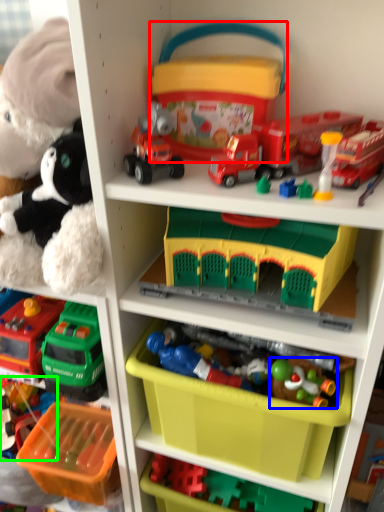
Question: Estimate the real-world distances between objects in this image. Which object is closer to storage box (highlighted by a red box), toy (highlighted by a blue box) or toy (highlighted by a green box)?

Choices:
 (A) toy
 (B) toy

Answer: (A)